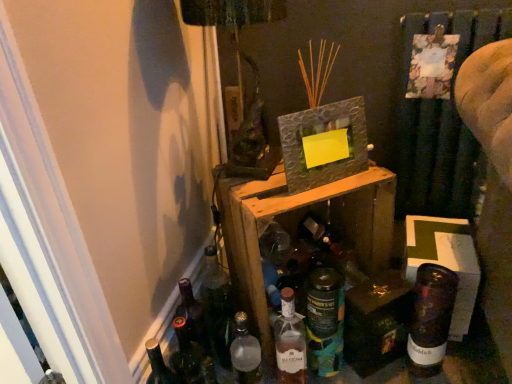
Question: From a real-world perspective, is textured gray picture frame at upper center physically above shiny dark brown bottle at lower right, the first bottle in the right-to-left sequence?

Choices:
 (A) no
 (B) yes

Answer: (B)

Question: Is textured gray picture frame at upper center closer to camera compared to shiny dark brown bottle at lower right, the first bottle in the right-to-left sequence?

Choices:
 (A) yes
 (B) no

Answer: (A)

Question: Can you confirm if textured gray picture frame at upper center is smaller than shiny dark brown bottle at lower right, the first bottle in the right-to-left sequence?

Choices:
 (A) no
 (B) yes

Answer: (B)

Question: From the image's perspective, is textured gray picture frame at upper center on shiny dark brown bottle at lower right, marked as the 4th bottle in a left-to-right arrangement?

Choices:
 (A) yes
 (B) no

Answer: (A)

Question: Could you tell me if textured gray picture frame at upper center is turned towards shiny dark brown bottle at lower right, marked as the 4th bottle in a left-to-right arrangement?

Choices:
 (A) no
 (B) yes

Answer: (A)

Question: Looking at the image, does matte glass bottle at center, which is the 3th bottle from right to left, seem bigger or smaller compared to translucent glass bottle at center, arranged as the second bottle when viewed from the right?

Choices:
 (A) small
 (B) big

Answer: (A)

Question: Is matte glass bottle at center, which is the second bottle in left-to-right order, inside or outside of translucent glass bottle at center, arranged as the second bottle when viewed from the right?

Choices:
 (A) inside
 (B) outside

Answer: (B)

Question: Is point (293, 342) closer or farther from the camera than point (344, 302)?

Choices:
 (A) closer
 (B) farther

Answer: (B)

Question: In terms of width, does matte glass bottle at center, which is the 3th bottle from right to left, look wider or thinner when compared to translucent glass bottle at center, arranged as the 3th bottle when viewed from the left?

Choices:
 (A) thin
 (B) wide

Answer: (A)

Question: Is translucent glass bottle at center, arranged as the 3th bottle when viewed from the left, taller or shorter than shiny dark brown bottle at lower right, marked as the 4th bottle in a left-to-right arrangement?

Choices:
 (A) short
 (B) tall

Answer: (B)

Question: From the image's perspective, is translucent glass bottle at center, arranged as the second bottle when viewed from the right, above or below shiny dark brown bottle at lower right, the first bottle in the right-to-left sequence?

Choices:
 (A) below
 (B) above

Answer: (A)

Question: Is translucent glass bottle at center, arranged as the second bottle when viewed from the right, wider or thinner than shiny dark brown bottle at lower right, marked as the 4th bottle in a left-to-right arrangement?

Choices:
 (A) thin
 (B) wide

Answer: (B)

Question: Based on their positions, is translucent glass bottle at center, arranged as the second bottle when viewed from the right, located to the left or right of shiny dark brown bottle at lower right, marked as the 4th bottle in a left-to-right arrangement?

Choices:
 (A) right
 (B) left

Answer: (B)

Question: Is translucent glass bottle at center, arranged as the 3th bottle when viewed from the left, in front of or behind wooden crate at center in the image?

Choices:
 (A) front
 (B) behind

Answer: (B)

Question: Considering the positions of translucent glass bottle at center, arranged as the 3th bottle when viewed from the left, and wooden crate at center in the image, is translucent glass bottle at center, arranged as the 3th bottle when viewed from the left, bigger or smaller than wooden crate at center?

Choices:
 (A) big
 (B) small

Answer: (B)